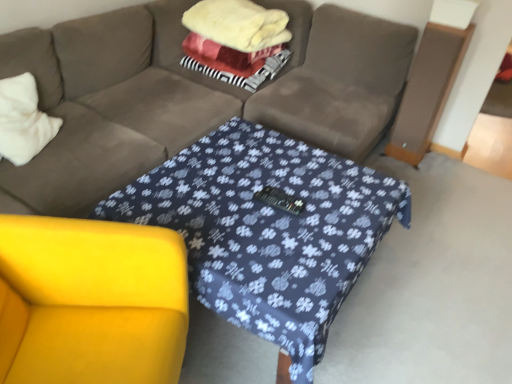
Question: From a real-world perspective, is fluffy white blanket at center positioned above or below yellow fabric armchair at lower left?

Choices:
 (A) below
 (B) above

Answer: (B)

Question: Would you say fluffy white blanket at center is inside or outside yellow fabric armchair at lower left?

Choices:
 (A) inside
 (B) outside

Answer: (B)

Question: Estimate the real-world distances between objects in this image. Which object is closer to the white soft pillow at left?

Choices:
 (A) yellow fabric armchair at lower left
 (B) fluffy white blanket at center

Answer: (A)

Question: Which object is positioned closest to the fluffy white blanket at center?

Choices:
 (A) white soft pillow at left
 (B) yellow fabric armchair at lower left

Answer: (A)